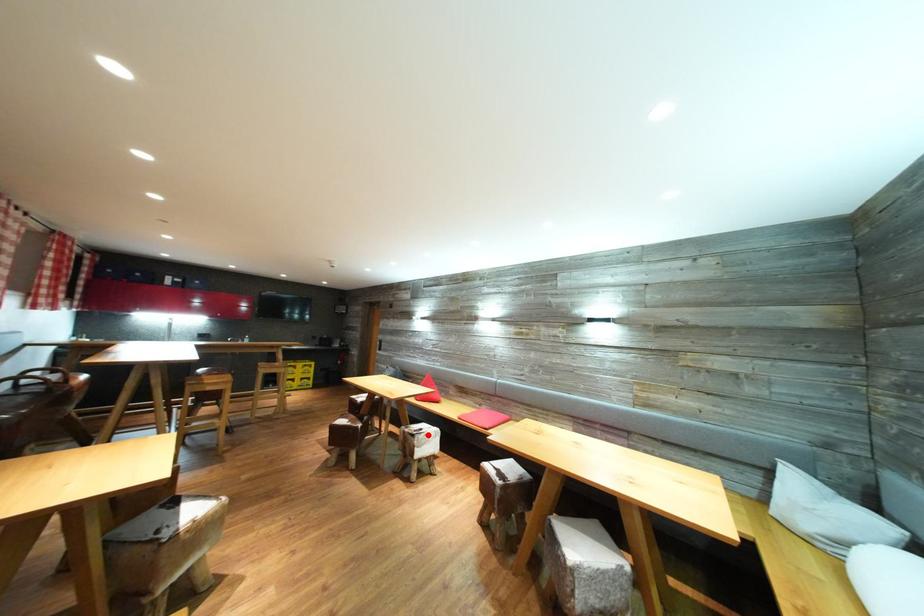
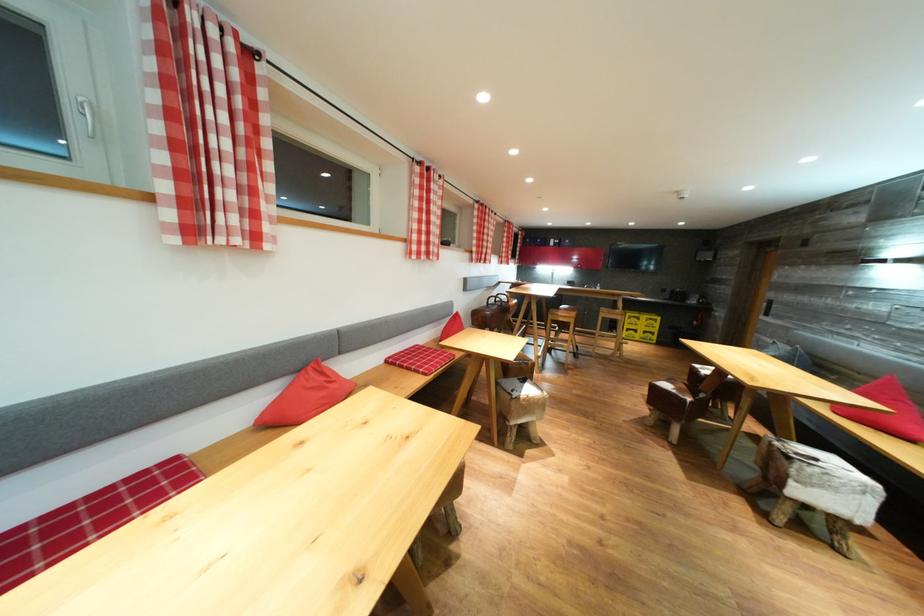
Question: I am providing you with two images of the same scene from different viewpoints. Given a red point in image1, look at the same physical point in image2. Is it:

Choices:
 (A) Closer to the viewpoint
 (B) Farther from the viewpoint

Answer: (A)